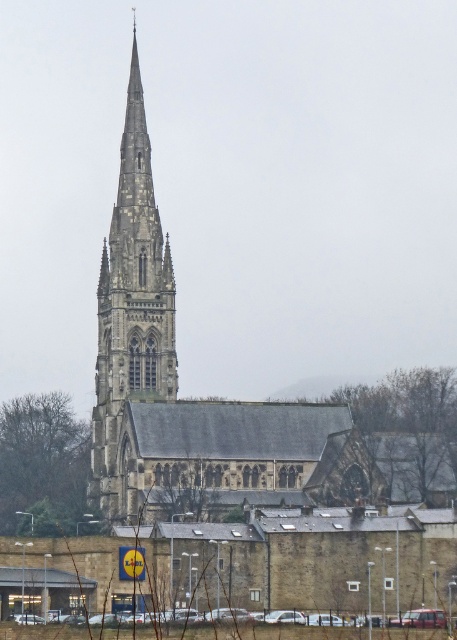
You are a photographer planning to capture the stone church steeple at center and the stone gothic tower at center in a single frame. Which of the two structures has a greater width when viewed from your current position?

The stone church steeple at center has a greater width than the stone gothic tower at center according to the description provided.

You are standing in front of the stone gothic tower at center and want to find the stone church steeple at center. In which direction should you look relative to the tower?

The stone church steeple at center is positioned on the right side of the stone gothic tower at center, so you should look to the right relative to the tower to find it.